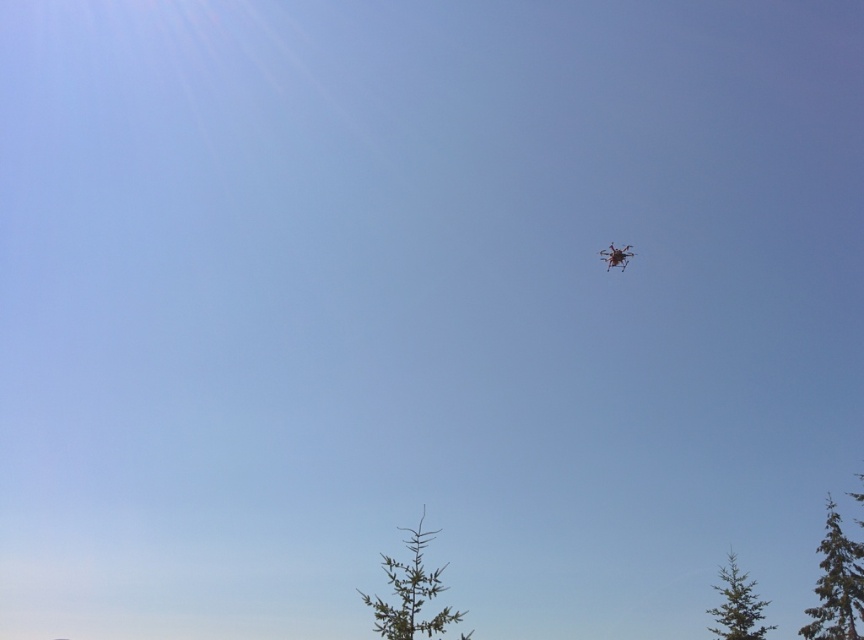
Question: Does green matte tree at lower right lie behind metallic silver drone at upper right?

Choices:
 (A) yes
 (B) no

Answer: (A)

Question: Which point is closer to the camera taking this photo?

Choices:
 (A) (731, 577)
 (B) (392, 605)

Answer: (B)

Question: Which point is closer to the camera?

Choices:
 (A) (840, 589)
 (B) (598, 253)
 (C) (761, 630)

Answer: (A)

Question: From the image, what is the correct spatial relationship of green matte tree at lower center in relation to green matte tree at lower right?

Choices:
 (A) right
 (B) left

Answer: (B)

Question: Where is green matte tree at lower center located in relation to green textured tree at lower right in the image?

Choices:
 (A) left
 (B) right

Answer: (A)

Question: Among these objects, which one is nearest to the camera?

Choices:
 (A) metallic silver drone at upper right
 (B) green matte tree at lower right
 (C) green textured tree at lower right
 (D) green matte tree at lower center

Answer: (D)